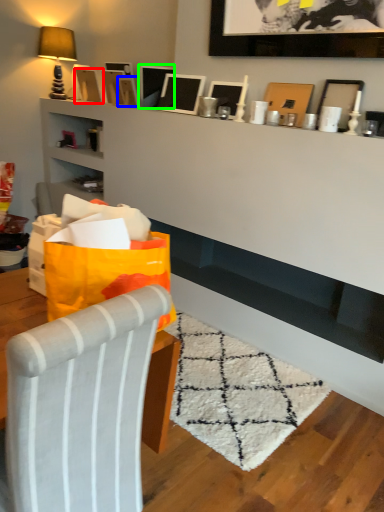
Question: Which object is the farthest from picture frame (highlighted by a red box)? Choose among these: picture frame (highlighted by a blue box) or picture frame (highlighted by a green box).

Choices:
 (A) picture frame
 (B) picture frame

Answer: (B)